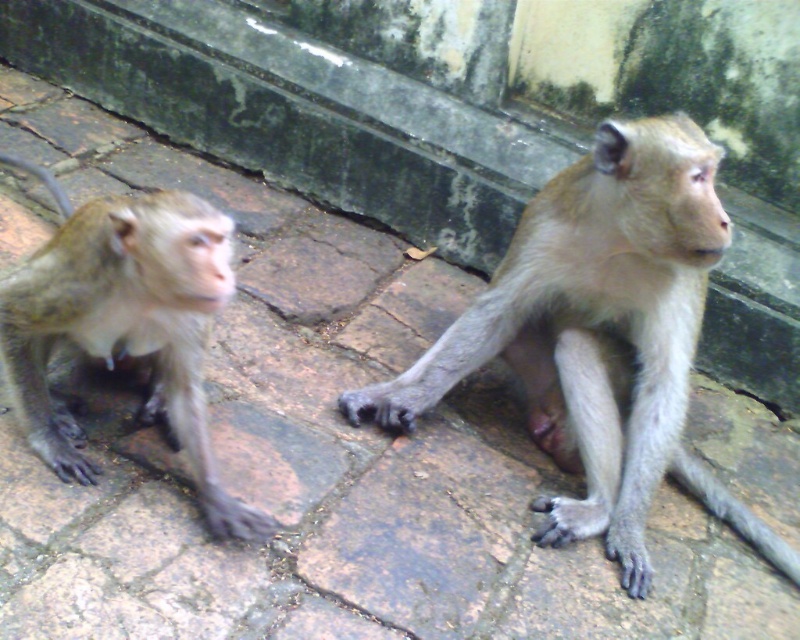
Can you confirm if light brown fur monkey at center is taller than light brown fur monkey at left?

Correct, light brown fur monkey at center is much taller as light brown fur monkey at left.

Which is more to the left, light brown fur monkey at center or light brown fur monkey at left?

light brown fur monkey at left

Does point (586, 429) lie behind point (52, 429)?

Yes, point (586, 429) is farther from viewer.

Identify the location of light brown fur monkey at center. The image size is (800, 640). (600, 336).